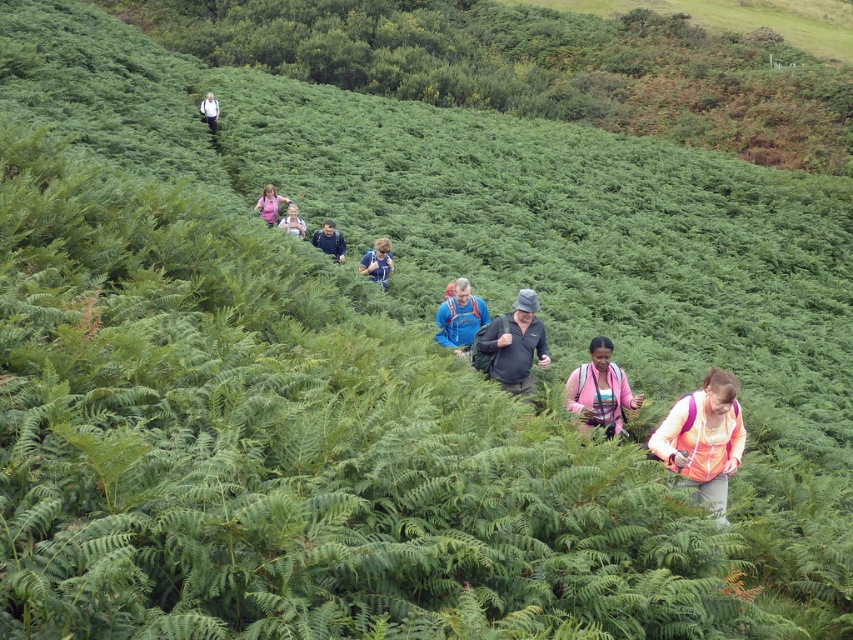
Does orange fabric backpack at lower right appear under dark blue jacket at center?

Indeed, orange fabric backpack at lower right is positioned under dark blue jacket at center.

Is point (699, 433) positioned before point (343, 257)?

Yes, it is.

Find the location of a particular element. The height and width of the screenshot is (640, 853). orange fabric backpack at lower right is located at coordinates (703, 438).

Which is behind, point (444, 301) or point (389, 266)?

The point (389, 266) is more distant.

Can you confirm if blue fabric backpack at center is taller than blue fabric shirt at center?

Yes, blue fabric backpack at center is taller than blue fabric shirt at center.

Where is `blue fabric backpack at center`? The width and height of the screenshot is (853, 640). blue fabric backpack at center is located at coordinates 459,317.

Is dark gray fabric jacket at center positioned in front of pink fabric backpack at center?

Yes, it is.

Between dark gray fabric jacket at center and pink fabric backpack at center, which one appears on the right side from the viewer's perspective?

Positioned to the right is dark gray fabric jacket at center.

The width and height of the screenshot is (853, 640). I want to click on dark gray fabric jacket at center, so click(515, 346).